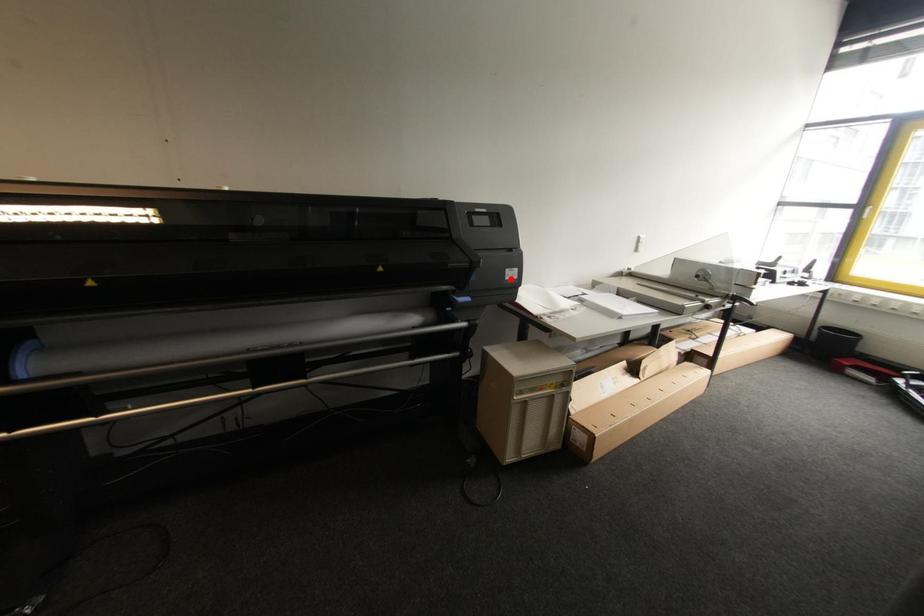
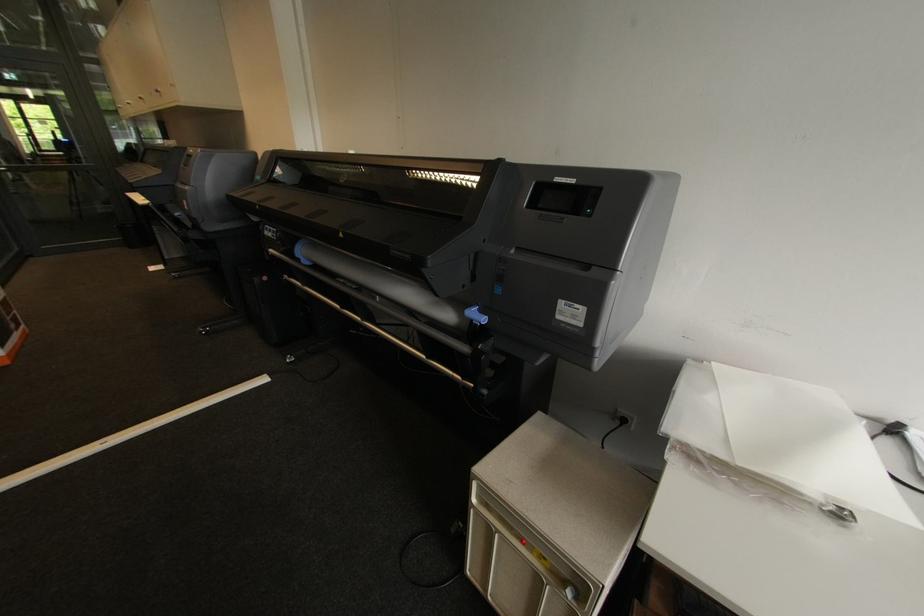
In the second image, find the point that corresponds to the highlighted location in the first image.

(563, 318)